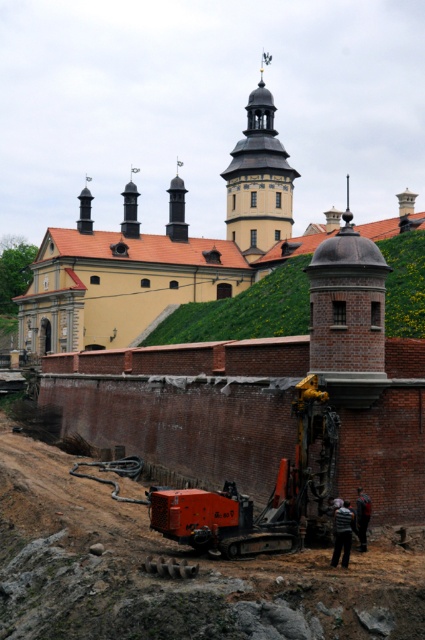
You are a construction worker standing at the base of the green grassy hillside at center. You need to move the orange metallic excavator at center to a new location. Can you lift the excavator over the hillside easily?

The orange metallic excavator at center is shorter than the green grassy hillside at center, so it can be moved over the hillside without needing to lift it over since it is shorter than the hillside.

You are a delivery truck driver who needs to drive through the brown dirt track at lower center to reach the construction site near the historical building. Can you safely pass through the track with your truck, considering the orange metallic excavator at center is currently operating there?

The brown dirt track at lower center might be wider than orange metallic excavator at center, so it is possible that the truck can pass safely if the excavator moves or pauses its operation temporarily. However, the driver should proceed with caution and confirm the current width availability.

You are standing at the construction site near the heavy machinery. A safety inspector has marked a point on the tower with coordinates point [25,556]. To ensure safety, you need to know if you are within a 150 feet radius of this point. Are you within the radius?

The distance between point [25,556] and the viewer is 149.90 feet, which is just under 150 feet. Therefore, you are within the 150 feet radius.